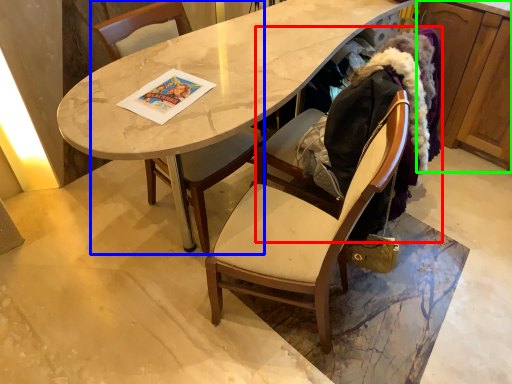
Question: Which is nearer to the folding chair (highlighted by a red box)? chair (highlighted by a blue box) or cabinetry (highlighted by a green box).

Choices:
 (A) chair
 (B) cabinetry

Answer: (A)